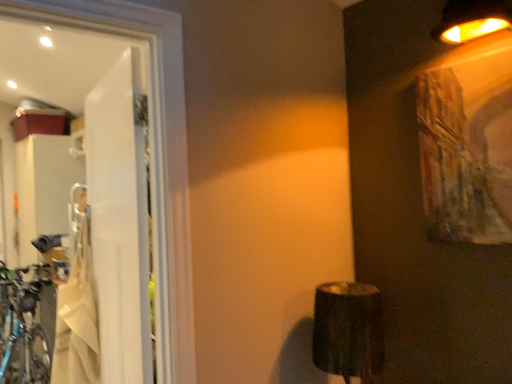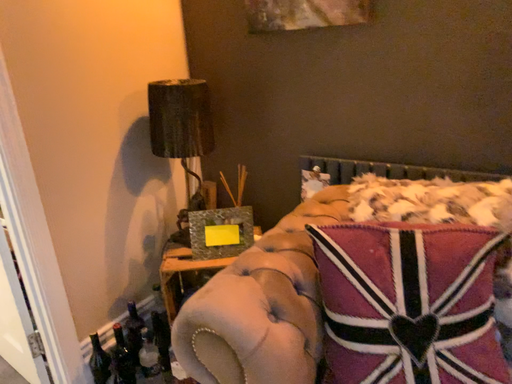
Question: How did the camera likely rotate when shooting the video?

Choices:
 (A) rotated right
 (B) rotated left

Answer: (A)